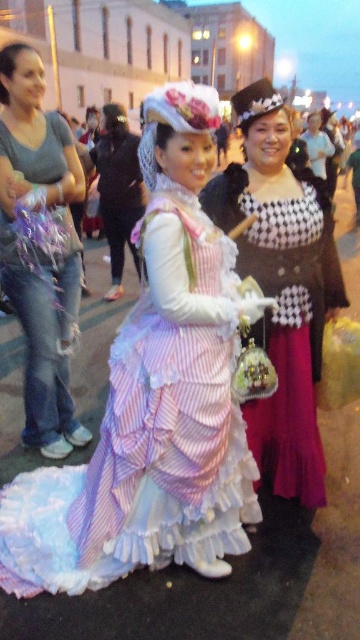
Based on the scene description, where is the pastel striped dress at center located in the image?

The pastel striped dress at center is located at point (x=154, y=397).

You are a photographer setting up a camera at the back of the scene. You want to capture both the pastel striped dress at center and the matte gray jeans at left in the same frame. Which object should you adjust your focus to first to ensure both are in the frame?

The pastel striped dress at center is wider than the matte gray jeans at left, so you should focus on the wider object first to ensure both fit in the frame.

You are a photographer at the event and want to capture both the pastel striped dress at center and the checkered fabric dress at center in a single frame. Which dress should you focus on first to ensure both are in the shot?

The pastel striped dress at center is shorter than the checkered fabric dress at center, so focusing on the checkered fabric dress at center first would allow you to frame both dresses appropriately.